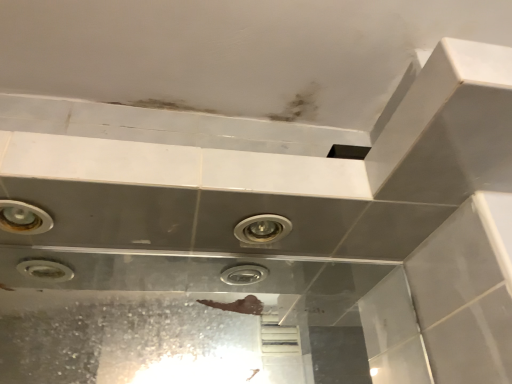
Question: Considering the positions of matte silver light fixture at center and matte silver light fixture at upper left in the image, is matte silver light fixture at center taller or shorter than matte silver light fixture at upper left?

Choices:
 (A) tall
 (B) short

Answer: (A)

Question: From the image's perspective, is matte silver light fixture at center above or below matte silver light fixture at upper left?

Choices:
 (A) above
 (B) below

Answer: (B)

Question: Based on their sizes in the image, would you say matte silver light fixture at center is bigger or smaller than matte silver light fixture at upper left?

Choices:
 (A) big
 (B) small

Answer: (A)

Question: Considering the positions of matte silver light fixture at upper left and matte silver light fixture at center in the image, is matte silver light fixture at upper left bigger or smaller than matte silver light fixture at center?

Choices:
 (A) small
 (B) big

Answer: (A)

Question: In the image, is matte silver light fixture at upper left on the left side or the right side of matte silver light fixture at center?

Choices:
 (A) right
 (B) left

Answer: (B)

Question: From their relative heights in the image, would you say matte silver light fixture at upper left is taller or shorter than matte silver light fixture at center?

Choices:
 (A) tall
 (B) short

Answer: (B)

Question: From a real-world perspective, is matte silver light fixture at upper left physically located above or below matte silver light fixture at center?

Choices:
 (A) below
 (B) above

Answer: (A)